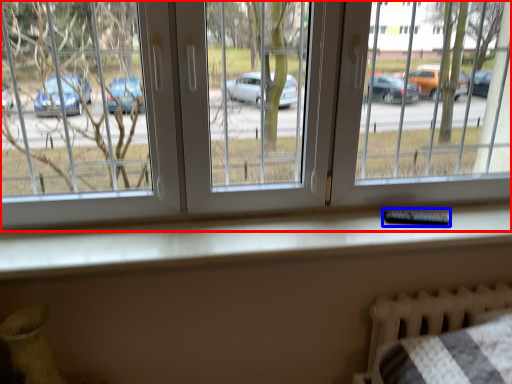
Question: Which object appears closest to the camera in this image, window (highlighted by a red box) or remote (highlighted by a blue box)?

Choices:
 (A) window
 (B) remote

Answer: (A)